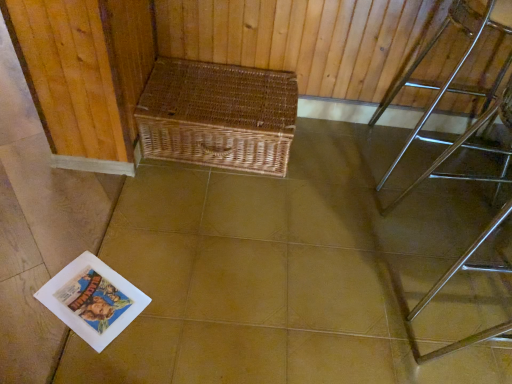
The height and width of the screenshot is (384, 512). What do you see at coordinates (283, 272) in the screenshot?
I see `woven wicker basket at upper center` at bounding box center [283, 272].

Measure the distance between point (289, 73) and camera.

The depth of point (289, 73) is 6.02 feet.

What is the approximate width of polished chrome table at right?

It is 50.61 centimeters.

Where is `woven wicker basket at upper center`? The image size is (512, 384). woven wicker basket at upper center is located at coordinates (283, 272).

From the image's perspective, which object appears higher, woven wicker basket at upper center or polished chrome table at right?

polished chrome table at right is shown above in the image.

The image size is (512, 384). Identify the location of square lying behind the polished chrome table at right. (283, 272).

Is woven wicker basket at upper center in front of or behind polished chrome table at right in the image?

woven wicker basket at upper center is behind polished chrome table at right.

Is woven wicker basket at upper center turned away from polished chrome table at right?

No.

Is woven brown picnic basket at center oriented away from woven wicker basket at upper center?

That's not correct — woven brown picnic basket at center is not looking away from woven wicker basket at upper center.

In the scene shown: What's the angular difference between woven brown picnic basket at center and woven wicker basket at upper center's facing directions?

They differ by 87.8 degrees in their facing directions.

Which is in front, point (191, 144) or point (371, 221)?

The point (371, 221) is closer.

Is woven brown picnic basket at center next to woven wicker basket at upper center and touching it?

No, woven brown picnic basket at center is not making contact with woven wicker basket at upper center.

Considering the sizes of objects polished chrome table at right and woven wicker basket at upper center in the image provided, who is taller, polished chrome table at right or woven wicker basket at upper center?

Standing taller between the two is polished chrome table at right.

Which of these two, polished chrome table at right or woven wicker basket at upper center, is bigger?

With larger size is polished chrome table at right.

Considering the positions of objects polished chrome table at right and woven wicker basket at upper center in the image provided, who is in front, polished chrome table at right or woven wicker basket at upper center?

polished chrome table at right is closer to the camera.

Considering the points (473, 11) and (122, 363), which point is behind, point (473, 11) or point (122, 363)?

The point (473, 11) is farther from the camera.

Can you confirm if woven wicker basket at upper center is positioned to the right of woven brown picnic basket at center?

Yes.

Which point is more forward, (490, 311) or (254, 95)?

Positioned in front is point (490, 311).

Based on the photo, which of these two, woven wicker basket at upper center or woven brown picnic basket at center, is smaller?

Smaller between the two is woven brown picnic basket at center.

Is woven wicker basket at upper center facing away from woven brown picnic basket at center?

No.

Which object is positioned more to the right, woven brown picnic basket at center or polished chrome table at right?

polished chrome table at right.

Are woven brown picnic basket at center and polished chrome table at right far apart?

Actually, woven brown picnic basket at center and polished chrome table at right are a little close together.

Can we say woven brown picnic basket at center lies outside polished chrome table at right?

Yes, woven brown picnic basket at center is outside of polished chrome table at right.

Is woven brown picnic basket at center facing towards polished chrome table at right?

No, woven brown picnic basket at center is not facing towards polished chrome table at right.

Considering the sizes of objects polished chrome table at right and woven brown picnic basket at center in the image provided, who is thinner, polished chrome table at right or woven brown picnic basket at center?

With smaller width is woven brown picnic basket at center.

In the scene shown: Which of these two, polished chrome table at right or woven brown picnic basket at center, is bigger?

Bigger between the two is polished chrome table at right.

Which object is positioned more to the right, polished chrome table at right or woven brown picnic basket at center?

From the viewer's perspective, polished chrome table at right appears more on the right side.

This screenshot has width=512, height=384. Find the location of `furniture located in front of the woven wicker basket at upper center`. furniture located in front of the woven wicker basket at upper center is located at coordinates (474, 123).

This screenshot has width=512, height=384. What are the coordinates of `square below the woven brown picnic basket at center (from a real-world perspective)` in the screenshot? It's located at (283, 272).

Estimate the real-world distances between objects in this image. Which object is further from woven wicker basket at upper center, polished chrome table at right or woven brown picnic basket at center?

Among the two, polished chrome table at right is located further to woven wicker basket at upper center.

Looking at the image, which one is located closer to polished chrome table at right, woven brown picnic basket at center or woven wicker basket at upper center?

woven wicker basket at upper center is positioned closer to the anchor polished chrome table at right.

Estimate the real-world distances between objects in this image. Which object is further from woven wicker basket at upper center, woven brown picnic basket at center or polished chrome table at right?

Based on the image, polished chrome table at right appears to be further to woven wicker basket at upper center.

Looking at the image, which one is located further to woven brown picnic basket at center, polished chrome table at right or woven wicker basket at upper center?

polished chrome table at right is further to woven brown picnic basket at center.

Considering their positions, is woven wicker basket at upper center positioned further to polished chrome table at right than woven brown picnic basket at center?

Based on the image, woven brown picnic basket at center appears to be further to polished chrome table at right.

Based on their spatial positions, is woven wicker basket at upper center or polished chrome table at right further from woven brown picnic basket at center?

Based on the image, polished chrome table at right appears to be further to woven brown picnic basket at center.

I want to click on square located between woven brown picnic basket at center and polished chrome table at right in the left-right direction, so click(x=283, y=272).